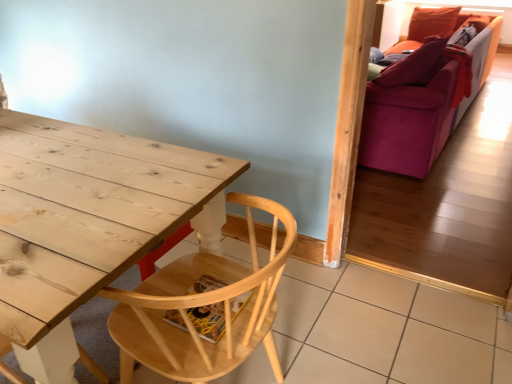
Measure the distance between velvet purple couch at right and camera.

A distance of 8.81 feet exists between velvet purple couch at right and camera.

Where is `velvet purple couch at right`? Image resolution: width=512 pixels, height=384 pixels. velvet purple couch at right is located at coordinates (421, 99).

What do you see at coordinates (421, 99) in the screenshot? I see `velvet purple couch at right` at bounding box center [421, 99].

Find the location of a particular element. This screenshot has height=384, width=512. natural wood chair at lower left is located at coordinates (200, 306).

Measure the distance between natural wood chair at lower left and camera.

natural wood chair at lower left and camera are 35.71 inches apart from each other.

The height and width of the screenshot is (384, 512). What do you see at coordinates (200, 306) in the screenshot? I see `natural wood chair at lower left` at bounding box center [200, 306].

Find the location of a particular element. velvet purple couch at right is located at coordinates (421, 99).

Is velvet purple couch at right to the left or to the right of natural wood chair at lower left in the image?

velvet purple couch at right is positioned on natural wood chair at lower left's right side.

Which object is closer to the camera taking this photo, velvet purple couch at right or natural wood chair at lower left?

natural wood chair at lower left.

Is point (398, 148) positioned behind point (138, 325)?

Yes, it is.

From the image's perspective, relative to natural wood chair at lower left, is velvet purple couch at right above or below?

Based on their image positions, velvet purple couch at right is located above natural wood chair at lower left.

From a real-world perspective, is velvet purple couch at right positioned under natural wood chair at lower left based on gravity?

No, from a real-world perspective, velvet purple couch at right is not below natural wood chair at lower left.

Can you confirm if velvet purple couch at right is wider than natural wood chair at lower left?

Yes.

Considering the relative sizes of velvet purple couch at right and natural wood chair at lower left in the image provided, is velvet purple couch at right taller than natural wood chair at lower left?

Indeed, velvet purple couch at right has a greater height compared to natural wood chair at lower left.

Does velvet purple couch at right have a larger size compared to natural wood chair at lower left?

Correct, velvet purple couch at right is larger in size than natural wood chair at lower left.

Looking at this image, can we say velvet purple couch at right lies outside natural wood chair at lower left?

Indeed, velvet purple couch at right is completely outside natural wood chair at lower left.

Are velvet purple couch at right and natural wood chair at lower left located far from each other?

That's right, there is a large distance between velvet purple couch at right and natural wood chair at lower left.

Is velvet purple couch at right oriented towards natural wood chair at lower left?

No, velvet purple couch at right is not facing towards natural wood chair at lower left.

The image size is (512, 384). Identify the location of studio couch behind the natural wood chair at lower left. (421, 99).

In the image, is natural wood chair at lower left on the left side or the right side of velvet purple couch at right?

In the image, natural wood chair at lower left appears on the left side of velvet purple couch at right.

In the scene shown: Is the depth of natural wood chair at lower left greater than that of velvet purple couch at right?

That is False.

Is point (273, 244) closer to viewer compared to point (392, 52)?

Yes.

In the scene shown: From the image's perspective, is natural wood chair at lower left located above or below velvet purple couch at right?

natural wood chair at lower left is below velvet purple couch at right.

From a real-world perspective, relative to velvet purple couch at right, is natural wood chair at lower left vertically above or below?

In terms of real-world spatial position, natural wood chair at lower left is below velvet purple couch at right.

Is natural wood chair at lower left wider than velvet purple couch at right?

Result: In fact, natural wood chair at lower left might be narrower than velvet purple couch at right.

Does natural wood chair at lower left have a lesser height compared to velvet purple couch at right?

Yes.

Does natural wood chair at lower left have a smaller size compared to velvet purple couch at right?

Yes.

Which is correct: natural wood chair at lower left is inside velvet purple couch at right, or outside of it?

natural wood chair at lower left is located beyond the bounds of velvet purple couch at right.

Is natural wood chair at lower left next to velvet purple couch at right?

No, natural wood chair at lower left is not with velvet purple couch at right.

Could you tell me if natural wood chair at lower left is facing velvet purple couch at right?

No, natural wood chair at lower left is not turned towards velvet purple couch at right.

How different are the orientations of natural wood chair at lower left and velvet purple couch at right in degrees?

The facing directions of natural wood chair at lower left and velvet purple couch at right are 176 degrees apart.

Identify the location of studio couch on the right of natural wood chair at lower left. The width and height of the screenshot is (512, 384). (421, 99).

Find the location of a particular element. This screenshot has width=512, height=384. studio couch behind the natural wood chair at lower left is located at coordinates (421, 99).

Locate an element on the screen. The height and width of the screenshot is (384, 512). studio couch on the right of natural wood chair at lower left is located at coordinates (421, 99).